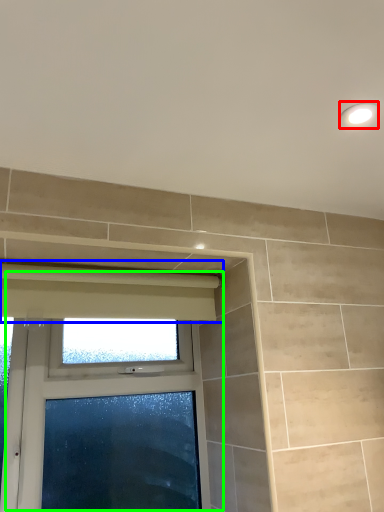
Question: Which is farther away from light fixture (highlighted by a red box)? curtain (highlighted by a blue box) or window (highlighted by a green box)?

Choices:
 (A) curtain
 (B) window

Answer: (B)